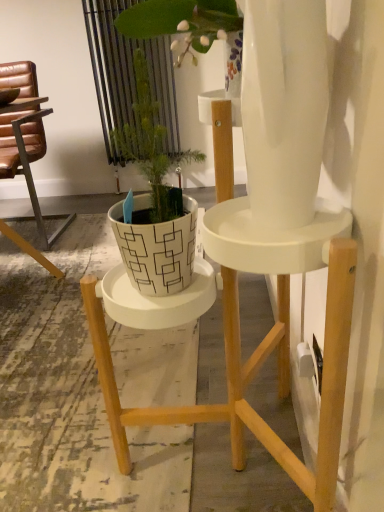
Question: Considering the positions of brown leather chair at left and white matte pot at center in the image, is brown leather chair at left wider or thinner than white matte pot at center?

Choices:
 (A) thin
 (B) wide

Answer: (B)

Question: Looking at the image, does brown leather chair at left seem bigger or smaller compared to white matte pot at center?

Choices:
 (A) small
 (B) big

Answer: (B)

Question: Visually, is brown leather chair at left positioned to the left or to the right of white matte pot at center?

Choices:
 (A) left
 (B) right

Answer: (A)

Question: In terms of height, does white matte pot at center look taller or shorter compared to brown leather chair at left?

Choices:
 (A) short
 (B) tall

Answer: (A)

Question: Relative to brown leather chair at left, is white matte pot at center in front or behind?

Choices:
 (A) behind
 (B) front

Answer: (B)

Question: Is white matte pot at center inside the boundaries of brown leather chair at left, or outside?

Choices:
 (A) outside
 (B) inside

Answer: (A)

Question: From the image's perspective, is white matte pot at center above or below brown leather chair at left?

Choices:
 (A) above
 (B) below

Answer: (B)